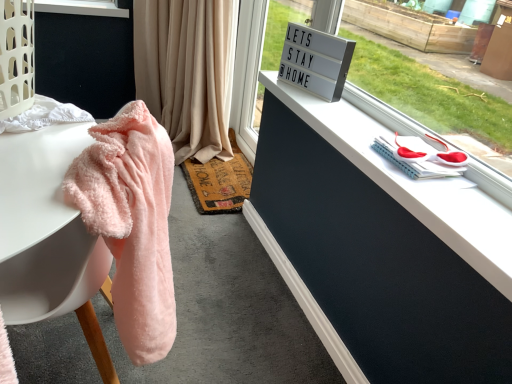
The image size is (512, 384). What are the coordinates of `blank space situated above white matte dresser at upper right (from a real-world perspective)` in the screenshot? It's located at (367, 134).